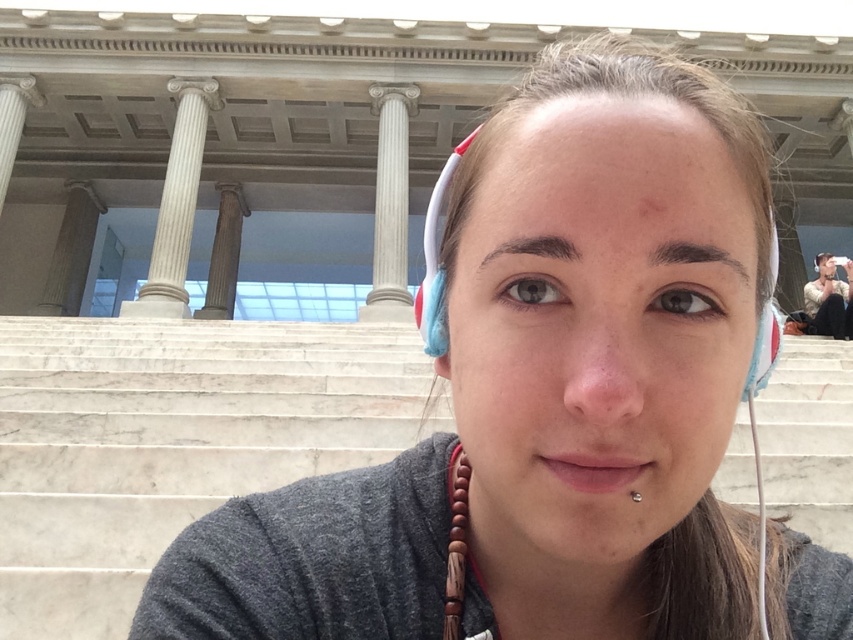
Does white marble column at center appear on the right side of smooth stone pillar at left?

Correct, you'll find white marble column at center to the right of smooth stone pillar at left.

Which of these two, white marble column at center or smooth stone pillar at left, stands taller?

white marble column at center

Does point (402, 284) lie in front of point (68, 289)?

Yes, point (402, 284) is in front of point (68, 289).

This screenshot has height=640, width=853. What are the coordinates of `white marble column at center` in the screenshot? It's located at (390, 204).

Who is positioned more to the right, white marble column at upper center or silver metallic earring at lower center?

Positioned to the right is silver metallic earring at lower center.

Can you confirm if white marble column at upper center is positioned above silver metallic earring at lower center?

Yes, white marble column at upper center is above silver metallic earring at lower center.

Between point (167, 90) and point (631, 493), which one is positioned behind?

Positioned behind is point (167, 90).

You are a GUI agent. You are given a task and a screenshot of the screen. Output one action in this format:
    pyautogui.click(x=<x>, y=<y>)
    Task: Click on the white marble column at upper center
    
    Given the screenshot: What is the action you would take?
    pyautogui.click(x=177, y=204)

Which of these two, light brown leather jacket at upper right or white marble pillar at upper left, stands shorter?

Standing shorter between the two is light brown leather jacket at upper right.

Is point (846, 257) farther from viewer compared to point (16, 109)?

Yes, point (846, 257) is farther from viewer.

The width and height of the screenshot is (853, 640). What are the coordinates of `light brown leather jacket at upper right` in the screenshot? It's located at (825, 301).